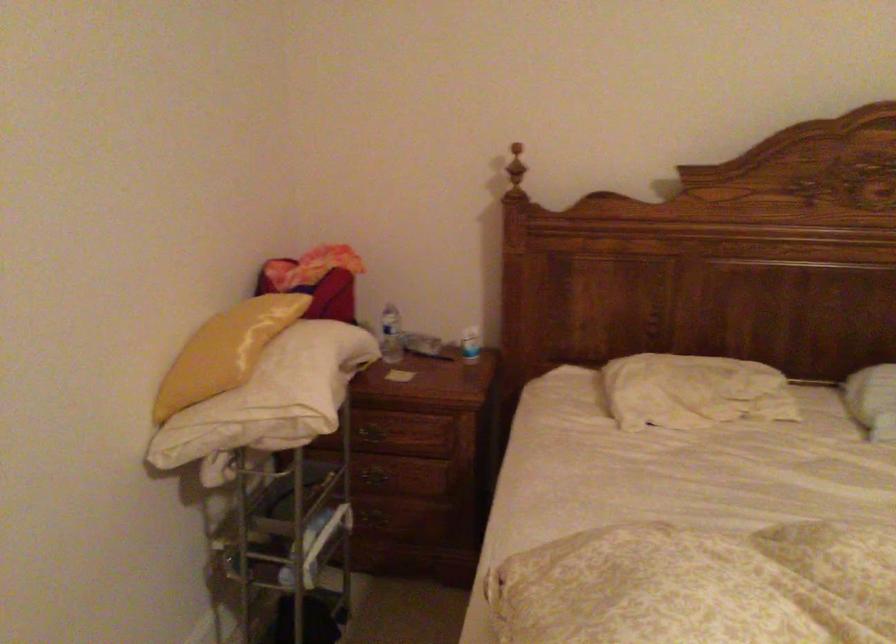
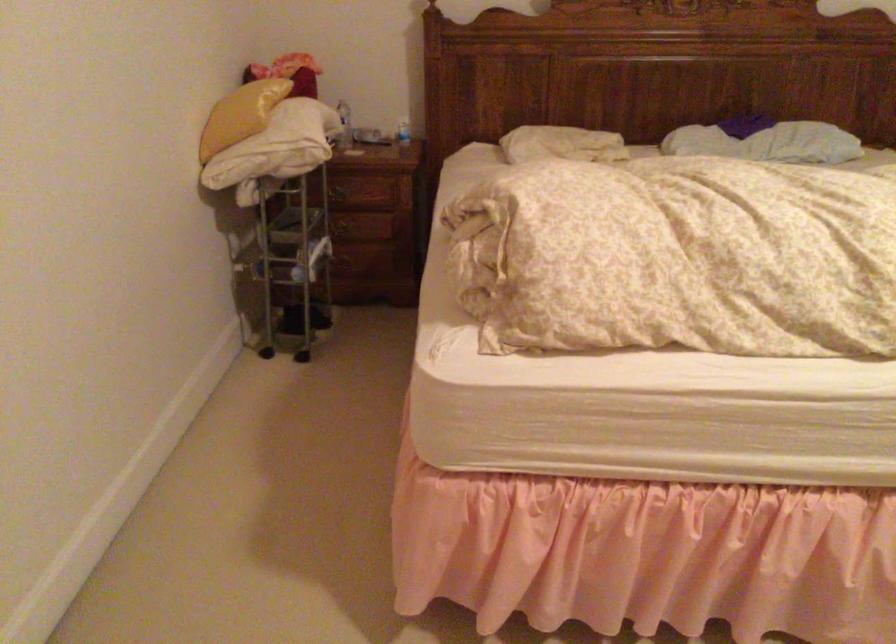
In the second image, find the point that corresponds to (x=211, y=359) in the first image.

(240, 115)